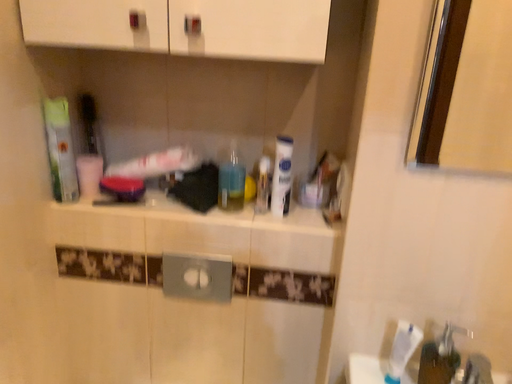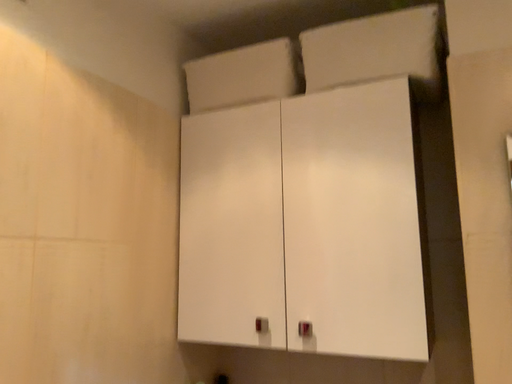
Question: How did the camera likely rotate when shooting the video?

Choices:
 (A) rotated left
 (B) rotated right

Answer: (A)